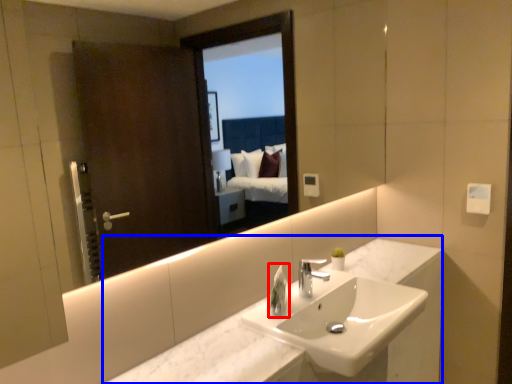
Question: Which point is closer to the camera, soap dispenser (highlighted by a red box) or counter (highlighted by a blue box)?

Choices:
 (A) soap dispenser
 (B) counter

Answer: (B)